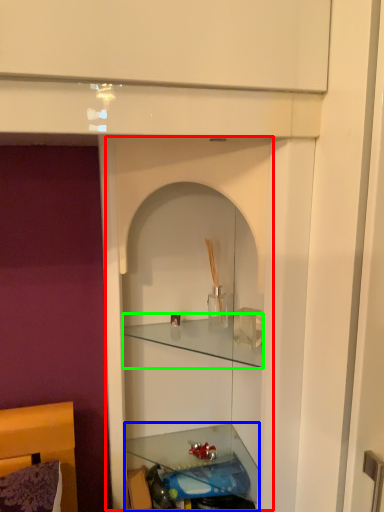
Question: Considering the real-world distances, which object is closest to cabinet (highlighted by a red box)? shelf (highlighted by a blue box) or cabinet (highlighted by a green box).

Choices:
 (A) shelf
 (B) cabinet

Answer: (B)